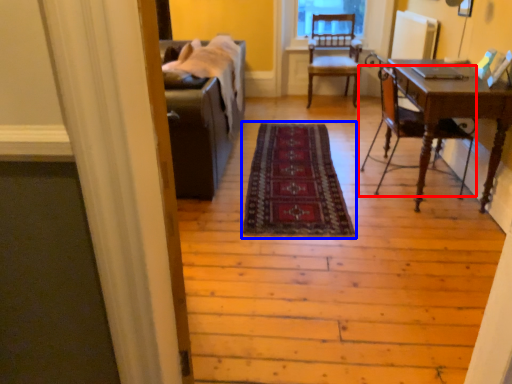
Question: Which object appears closest to the camera in this image, chair (highlighted by a red box) or mat (highlighted by a blue box)?

Choices:
 (A) chair
 (B) mat

Answer: (B)